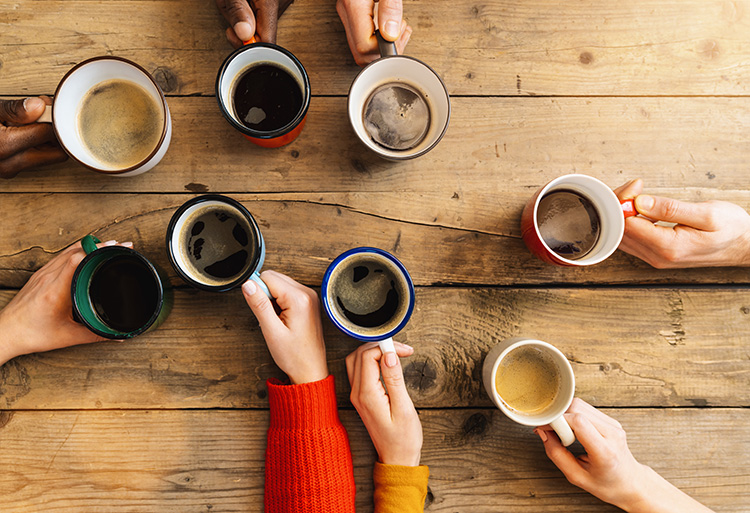
Locate an element on the screen. Image resolution: width=750 pixels, height=513 pixels. mugs is located at coordinates tap(87, 295), tap(69, 106), tap(234, 65), tap(382, 72), tap(588, 183), tap(568, 378), tap(405, 309), tap(186, 258).